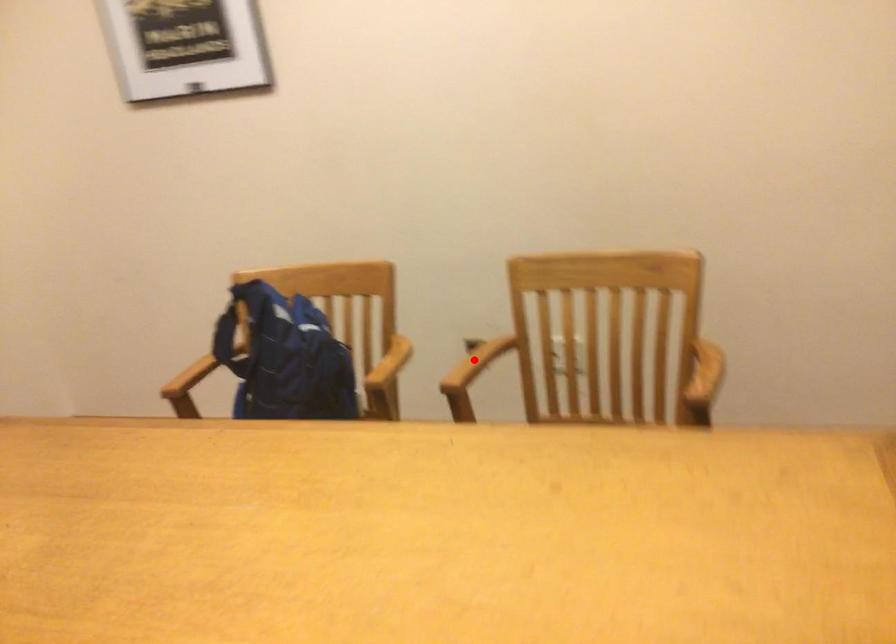
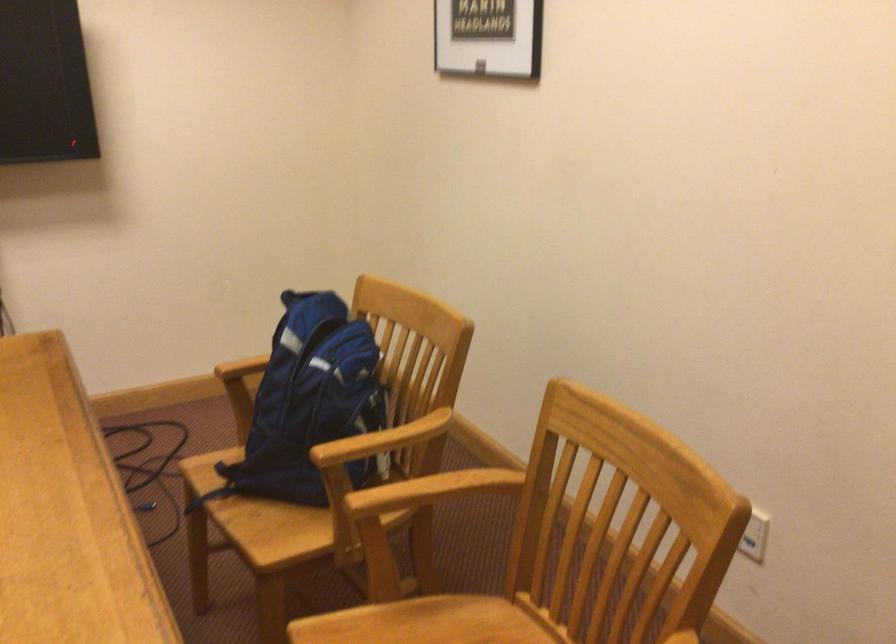
Locate, in the second image, the point that corresponds to the highlighted location in the first image.

(436, 488)